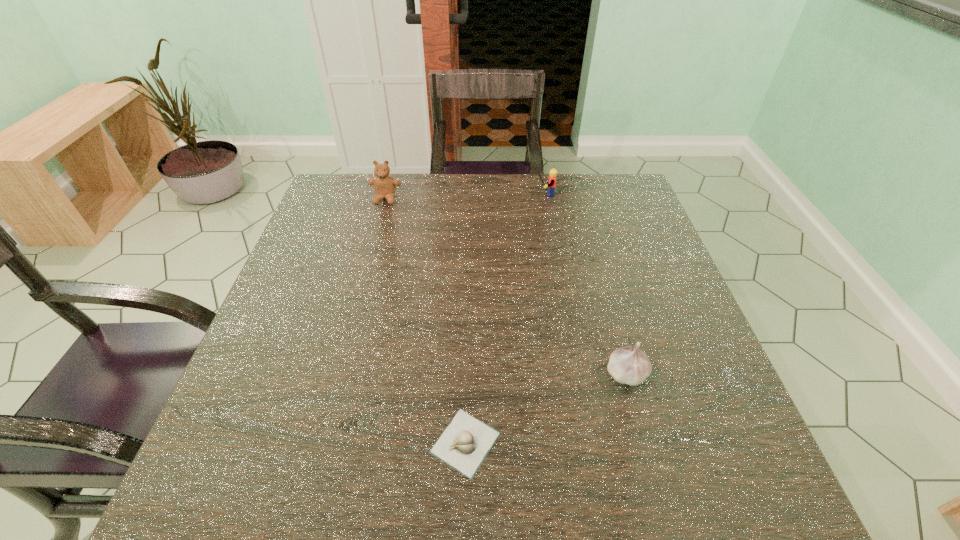
The width and height of the screenshot is (960, 540). Identify the location of free space located on the left of the rightmost object. (402, 374).

I want to click on vacant space located 0.400m on the right of the left garlic, so click(732, 443).

Locate an element on the screen. The width and height of the screenshot is (960, 540). Lego at the far edge is located at coordinates (553, 173).

The width and height of the screenshot is (960, 540). Identify the location of teddy bear located at the far edge. (384, 185).

Locate an element on the screen. object situated at the near edge is located at coordinates (464, 444).

The width and height of the screenshot is (960, 540). I want to click on object that is at the left edge, so click(384, 185).

Locate an element on the screen. The image size is (960, 540). object at the right edge is located at coordinates (628, 365).

The width and height of the screenshot is (960, 540). Find the location of `object present at the far left corner`. object present at the far left corner is located at coordinates (384, 185).

In the image, there is a desktop. Identify the location of vacant space at the far edge. (521, 208).

Identify the location of free location at the near edge of the desktop. (611, 498).